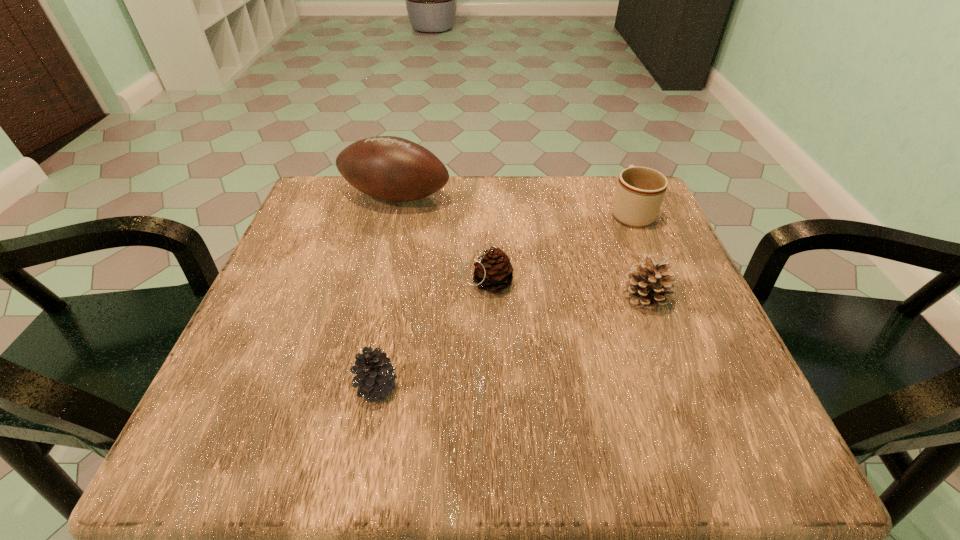
Locate an element on the screen. the tallest object is located at coordinates (388, 168).

Where is `mug`? Image resolution: width=960 pixels, height=540 pixels. mug is located at coordinates (640, 191).

I want to click on the rightmost pinecone, so click(x=647, y=284).

Identify the location of the second pinecone from left to right. (493, 272).

This screenshot has height=540, width=960. In order to click on the nearest object in this screenshot , I will do `click(375, 377)`.

The image size is (960, 540). In order to click on the leftmost pinecone in this screenshot , I will do `click(375, 377)`.

You are a GUI agent. You are given a task and a screenshot of the screen. Output one action in this format:
    pyautogui.click(x=<x>, y=<y>)
    Task: Click on the blank space located on the right of the tallest object
    The height and width of the screenshot is (540, 960).
    Given the screenshot: What is the action you would take?
    pyautogui.click(x=516, y=197)

This screenshot has width=960, height=540. I want to click on free region located 0.190m on the back of the rightmost pinecone, so click(x=617, y=221).

Find the location of a particular element. vacant space located 0.100m with a leaf charm attached to the second pinecone from left to right is located at coordinates (412, 283).

Locate an element on the screen. Image resolution: width=960 pixels, height=540 pixels. vacant space located 0.260m with a leaf charm attached to the second pinecone from left to right is located at coordinates (329, 283).